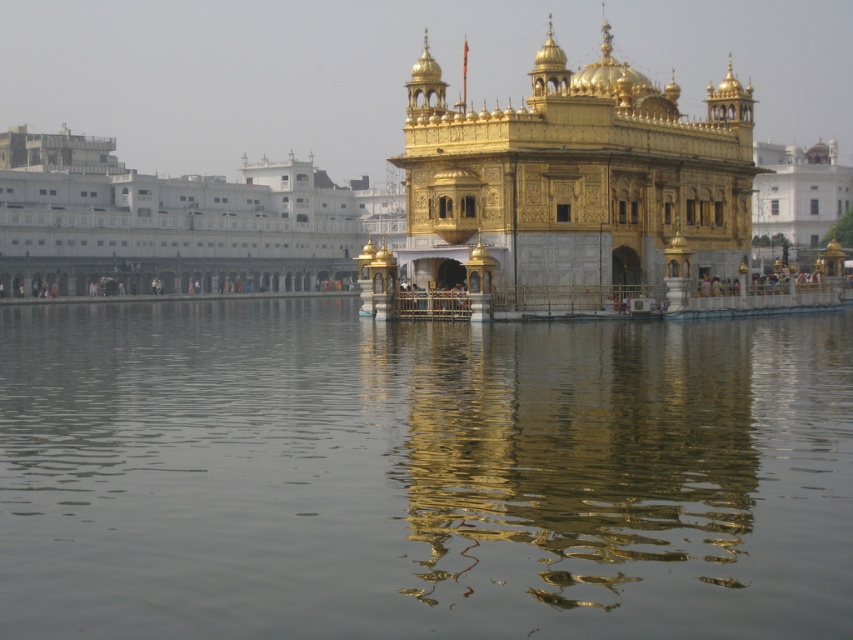
Question: Considering the relative positions of transparent water at center and gold polished temple at center in the image provided, where is transparent water at center located with respect to gold polished temple at center?

Choices:
 (A) left
 (B) right

Answer: (A)

Question: Can you confirm if transparent water at center is bigger than gold polished temple at center?

Choices:
 (A) no
 (B) yes

Answer: (A)

Question: Which point appears closest to the camera in this image?

Choices:
 (A) (611, 212)
 (B) (799, 456)

Answer: (B)

Question: Which point is closer to the camera taking this photo?

Choices:
 (A) (715, 616)
 (B) (688, 200)

Answer: (A)

Question: Among these points, which one is farthest from the camera?

Choices:
 (A) (422, 275)
 (B) (598, 545)

Answer: (A)

Question: Is transparent water at center to the right of gold polished temple at center from the viewer's perspective?

Choices:
 (A) no
 (B) yes

Answer: (A)